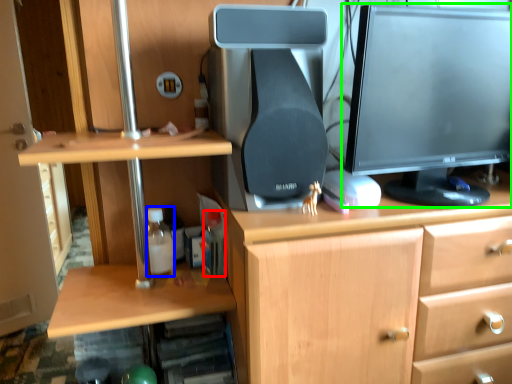
Question: Based on their relative distances, which object is farther from bottle (highlighted by a red box)? Choose from bottle (highlighted by a blue box) and computer monitor (highlighted by a green box).

Choices:
 (A) bottle
 (B) computer monitor

Answer: (B)